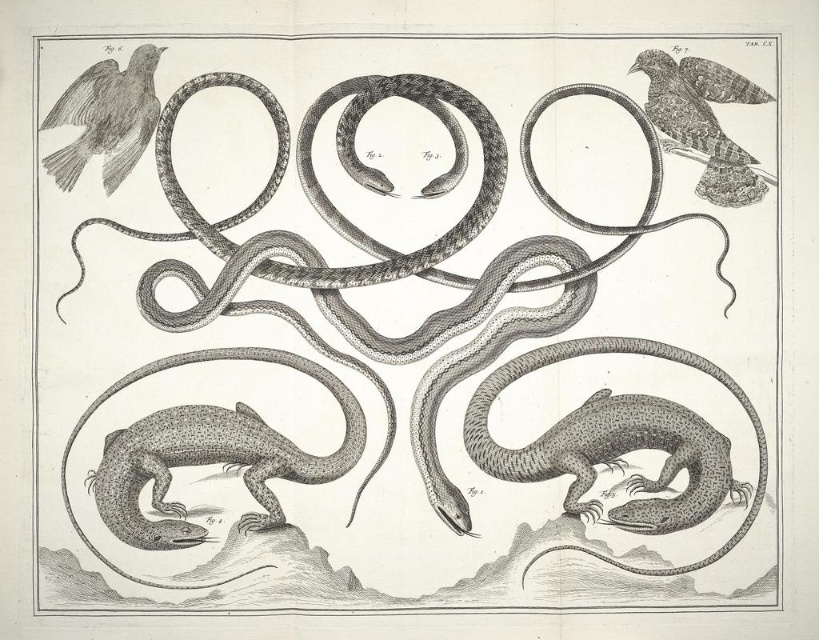
Who is more forward, (686, 460) or (148, 416)?

Point (148, 416) is more forward.

Does speckled textured lizard at center have a larger size compared to speckled textured lizard at lower left?

Incorrect, speckled textured lizard at center is not larger than speckled textured lizard at lower left.

This screenshot has width=819, height=640. What are the coordinates of `speckled textured lizard at center` in the screenshot? It's located at (618, 440).

Which of these two, speckled textured lizard at center or smooth gray bird at upper left, stands taller?

speckled textured lizard at center

Between point (612, 348) and point (77, 172), which one is positioned behind?

Point (77, 172)

Is point (695, 461) more distant than point (100, 61)?

No, (695, 461) is closer to viewer.

At what (x,y) coordinates should I click in order to perform the action: click on speckled textured lizard at center. Please return your answer as a coordinate pair (x, y). This screenshot has width=819, height=640. Looking at the image, I should click on (618, 440).

Does speckled gray lizard at center have a lesser width compared to speckled textured lizard at lower left?

No, speckled gray lizard at center is not thinner than speckled textured lizard at lower left.

Is speckled gray lizard at center to the right of speckled textured lizard at lower left from the viewer's perspective?

Indeed, speckled gray lizard at center is positioned on the right side of speckled textured lizard at lower left.

Is point (620, 352) behind point (152, 547)?

Yes, point (620, 352) is behind point (152, 547).

Locate an element on the screen. speckled gray lizard at center is located at coordinates (397, 259).